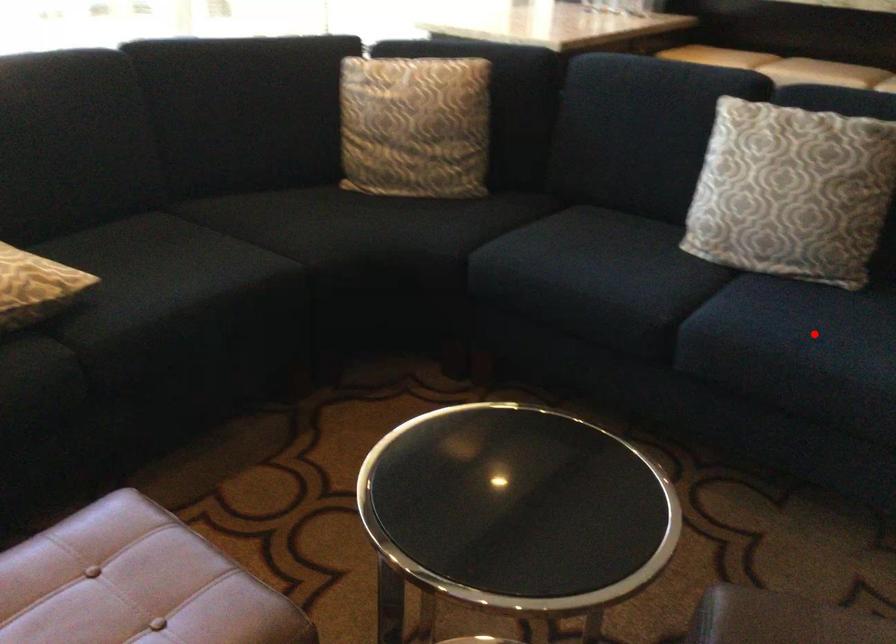
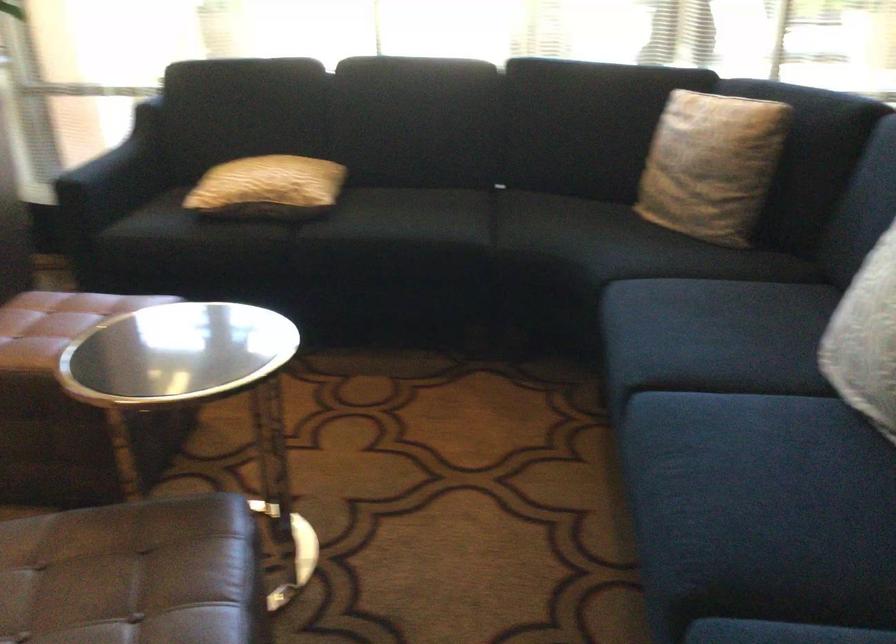
Question: I am providing you with two images of the same scene from different viewpoints. Image1 has a red point marked. In image2, the corresponding 3D location appears at what relative position? Reply with the corresponding letter.

Choices:
 (A) Closer
 (B) Farther

Answer: (A)